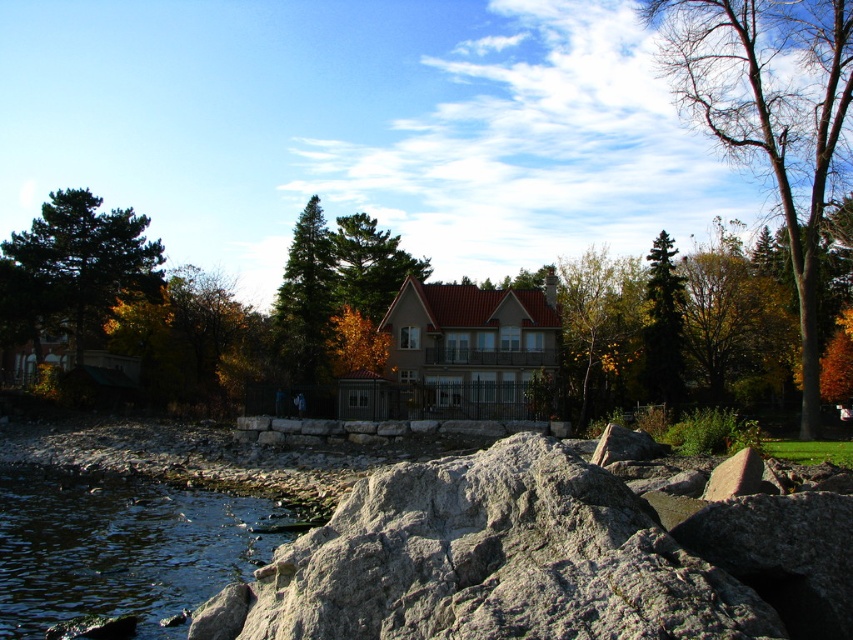
You are standing at the point with coordinates point (756, 104) and want to walk to the point with coordinates point (675, 385). Based on the scene description, which direction should you walk to reach your destination?

You should walk towards the direction away from the shoreline since point (756, 104) is in front of point (675, 385), meaning it is closer to the observer. To reach the latter, you need to move away from the current position towards the house or further inland.

You are planning to take a photo of the two trees in the scene. The green textured pine tree at center and the orange leafy tree at center are both in your viewfinder. Which tree should you focus on if you want to capture the wider tree in your photo?

The green textured pine tree at center is wider than the orange leafy tree at center, so you should focus on the green textured pine tree at center to capture the wider tree in your photo.